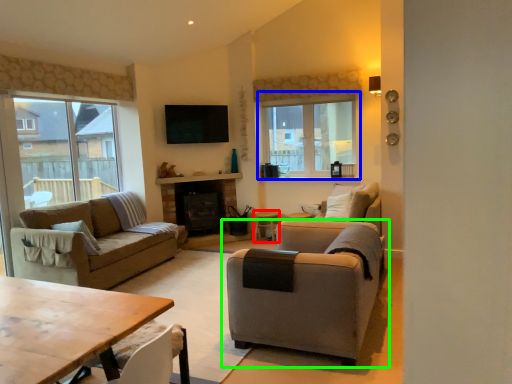
Question: Considering the real-world distances, which object is closest to side table (highlighted by a red box)? window (highlighted by a blue box) or chair (highlighted by a green box).

Choices:
 (A) window
 (B) chair

Answer: (A)